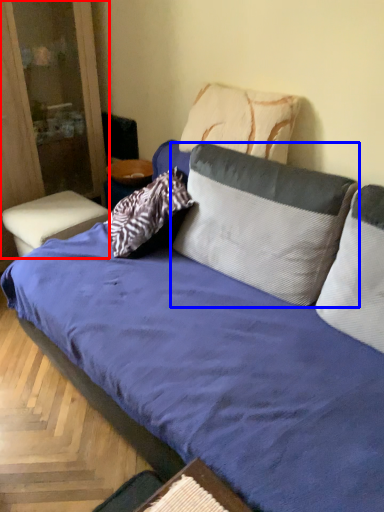
Question: Which of the following is the closest to the observer, dresser (highlighted by a red box) or pillow (highlighted by a blue box)?

Choices:
 (A) dresser
 (B) pillow

Answer: (B)